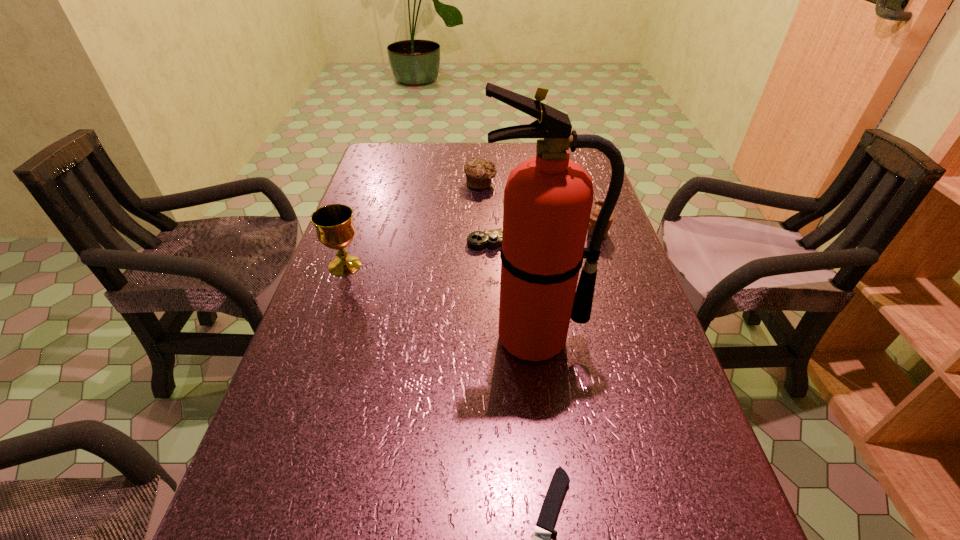
The image size is (960, 540). Identify the location of blank space at the right edge of the desktop. (609, 280).

Find the location of `vacant space at the far left corner of the desktop`. vacant space at the far left corner of the desktop is located at coordinates (401, 172).

Where is `free space that is in between the second shortest object and the third shortest object`? The width and height of the screenshot is (960, 540). free space that is in between the second shortest object and the third shortest object is located at coordinates (489, 211).

In order to click on vacant space that is in between the leftmost object and the tallest object in this screenshot , I will do `click(440, 301)`.

What are the coordinates of `vacant space that's between the chalice and the third shortest object` in the screenshot? It's located at (413, 224).

This screenshot has height=540, width=960. Find the location of `vacant space that is in between the fourth farthest object and the taller muffin`. vacant space that is in between the fourth farthest object and the taller muffin is located at coordinates (470, 249).

At what (x,y) coordinates should I click in order to perform the action: click on object that is the fifth closest to the steak knife. Please return your answer as a coordinate pair (x, y). Looking at the image, I should click on (479, 173).

Point out which object is positioned as the nearest to the second shortest object. Please provide its 2D coordinates. Your answer should be formatted as a tuple, i.e. [(x, y)], where the tuple contains the x and y coordinates of a point satisfying the conditions above.

[(598, 204)]